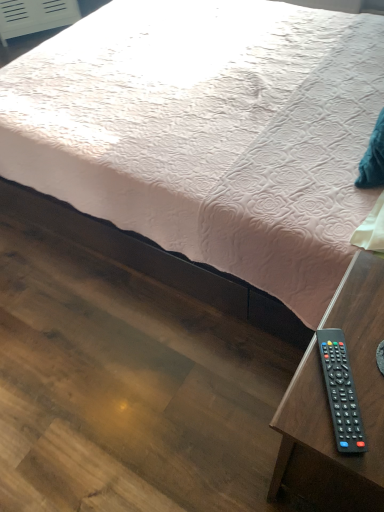
Question: Would you say black plastic remote at lower right is part of pink quilted fabric at center's contents?

Choices:
 (A) yes
 (B) no

Answer: (B)

Question: From the image's perspective, is pink quilted fabric at center above black plastic remote at lower right?

Choices:
 (A) yes
 (B) no

Answer: (A)

Question: Can you confirm if pink quilted fabric at center is thinner than black plastic remote at lower right?

Choices:
 (A) no
 (B) yes

Answer: (A)

Question: Can we say pink quilted fabric at center lies outside black plastic remote at lower right?

Choices:
 (A) yes
 (B) no

Answer: (A)

Question: Considering the relative sizes of pink quilted fabric at center and black plastic remote at lower right in the image provided, is pink quilted fabric at center smaller than black plastic remote at lower right?

Choices:
 (A) no
 (B) yes

Answer: (A)

Question: From the image's perspective, relative to black plastic remote at lower right, is black plastic remote at lower right above or below?

Choices:
 (A) below
 (B) above

Answer: (A)

Question: Is black plastic remote at lower right wider or thinner than black plastic remote at lower right?

Choices:
 (A) wide
 (B) thin

Answer: (A)

Question: Does point (357, 312) appear closer or farther from the camera than point (336, 432)?

Choices:
 (A) farther
 (B) closer

Answer: (A)

Question: Is black plastic remote at lower right inside or outside of black plastic remote at lower right?

Choices:
 (A) outside
 (B) inside

Answer: (A)

Question: Looking at their shapes, would you say black plastic remote at lower right is wider or thinner than pink quilted fabric at center?

Choices:
 (A) thin
 (B) wide

Answer: (A)

Question: Based on their sizes in the image, would you say black plastic remote at lower right is bigger or smaller than pink quilted fabric at center?

Choices:
 (A) big
 (B) small

Answer: (B)

Question: Is black plastic remote at lower right inside the boundaries of pink quilted fabric at center, or outside?

Choices:
 (A) inside
 (B) outside

Answer: (B)

Question: Considering the positions of black plastic remote at lower right and pink quilted fabric at center in the image, is black plastic remote at lower right taller or shorter than pink quilted fabric at center?

Choices:
 (A) short
 (B) tall

Answer: (A)

Question: Considering their positions, is black plastic remote at lower right located in front of or behind pink quilted fabric at center?

Choices:
 (A) behind
 (B) front

Answer: (A)

Question: Would you say black plastic remote at lower right is inside or outside pink quilted fabric at center?

Choices:
 (A) inside
 (B) outside

Answer: (B)